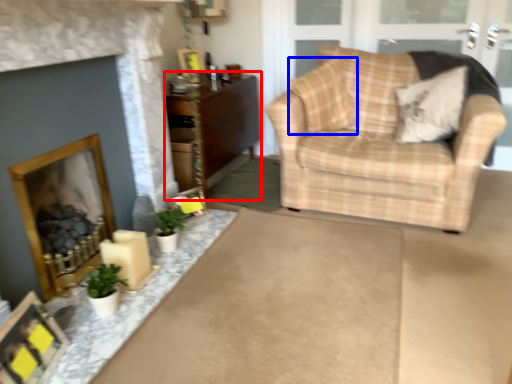
Question: Which object appears farthest to the camera in this image, cabinetry (highlighted by a red box) or pillow (highlighted by a blue box)?

Choices:
 (A) cabinetry
 (B) pillow

Answer: (A)